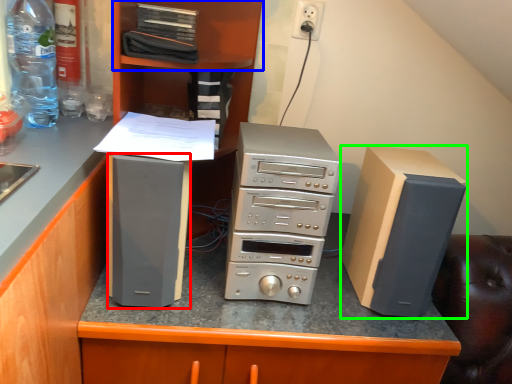
Question: Which object is the farthest from appliance (highlighted by a red box)? Choose among these: shelf (highlighted by a blue box) or computer tower (highlighted by a green box).

Choices:
 (A) shelf
 (B) computer tower

Answer: (A)